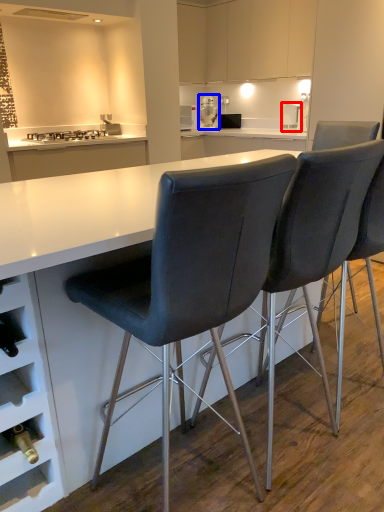
Question: Which object appears closest to the camera in this image, kitchen appliance (highlighted by a red box) or appliance (highlighted by a blue box)?

Choices:
 (A) kitchen appliance
 (B) appliance

Answer: (A)